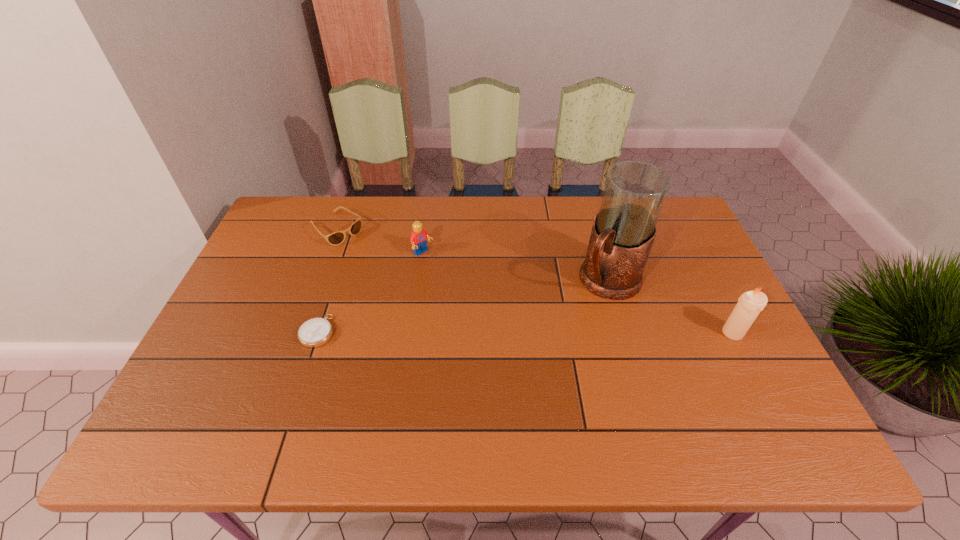
Choose which object is the third nearest neighbor to the candle. Please provide its 2D coordinates. Your answer should be formatted as a tuple, i.e. [(x, y)], where the tuple contains the x and y coordinates of a point satisfying the conditions above.

[(315, 332)]

Where is `vacant area that satisfies the following two spatial constraints: 1. on the front side of the pitcher; 2. on the right side of the sunglasses`? The height and width of the screenshot is (540, 960). vacant area that satisfies the following two spatial constraints: 1. on the front side of the pitcher; 2. on the right side of the sunglasses is located at coordinates (318, 281).

At what (x,y) coordinates should I click in order to perform the action: click on free space that satisfies the following two spatial constraints: 1. on the back side of the compass; 2. on the right side of the pitcher. Please return your answer as a coordinate pair (x, y). Image resolution: width=960 pixels, height=540 pixels. Looking at the image, I should click on (334, 281).

Where is `free space that satisfies the following two spatial constraints: 1. on the front side of the third tallest object; 2. on the left side of the tallest object`? The image size is (960, 540). free space that satisfies the following two spatial constraints: 1. on the front side of the third tallest object; 2. on the left side of the tallest object is located at coordinates (419, 281).

The height and width of the screenshot is (540, 960). Identify the location of free space in the image that satisfies the following two spatial constraints: 1. on the back side of the compass; 2. on the right side of the second object from right to left. (334, 281).